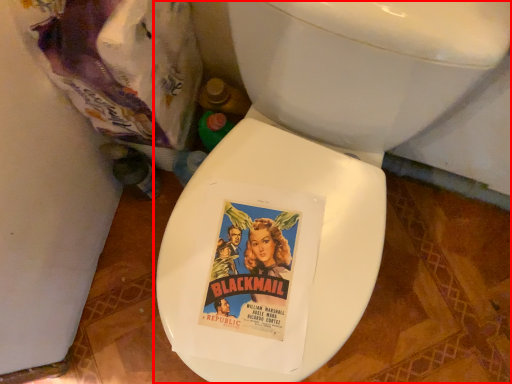
Question: Observing the image, what is the correct spatial positioning of toilet (annotated by the red box) in reference to garbage?

Choices:
 (A) left
 (B) right

Answer: (B)